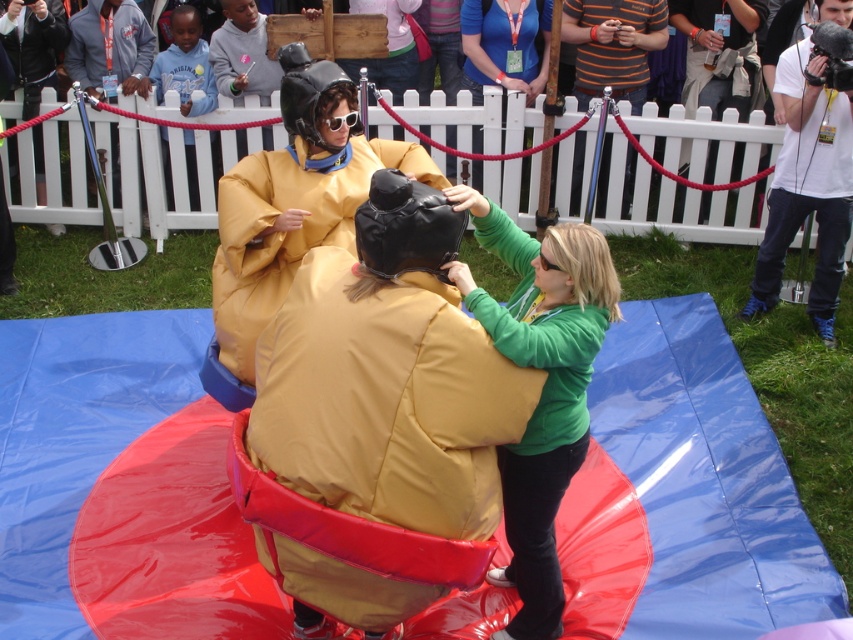
Question: Which point is farther to the camera?

Choices:
 (A) (76, 52)
 (B) (593, 236)

Answer: (A)

Question: Is matte yellow sumo at center closer to camera compared to gray fleece jacket at upper left?

Choices:
 (A) yes
 (B) no

Answer: (A)

Question: Does matte yellow sumo at center appear over gray fleece jacket at upper left?

Choices:
 (A) yes
 (B) no

Answer: (B)

Question: Which object appears closest to the camera in this image?

Choices:
 (A) matte yellow sumo at center
 (B) striped cotton shirt at upper center

Answer: (A)

Question: Can you confirm if matte yellow sumo at center is smaller than gray fleece jacket at upper left?

Choices:
 (A) yes
 (B) no

Answer: (B)

Question: Among these objects, which one is nearest to the camera?

Choices:
 (A) green matte shirt at center
 (B) striped cotton shirt at upper center

Answer: (A)